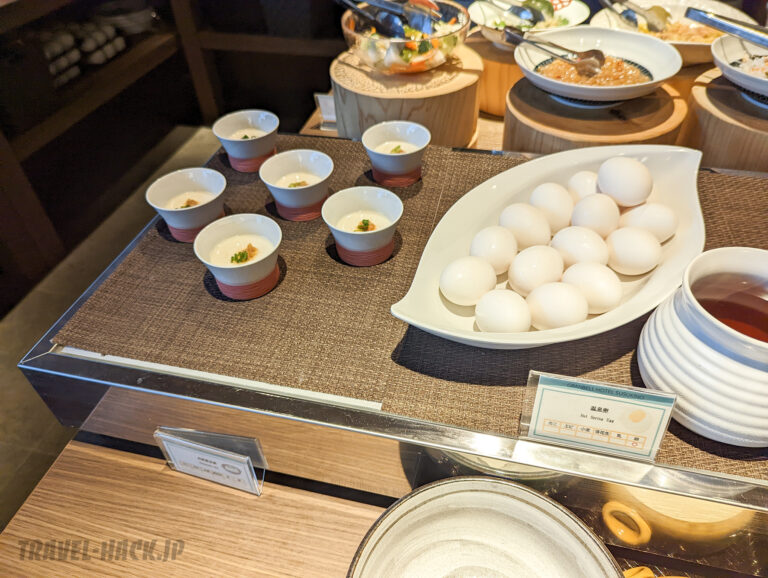
I want to click on circular jug, so tap(667, 359).